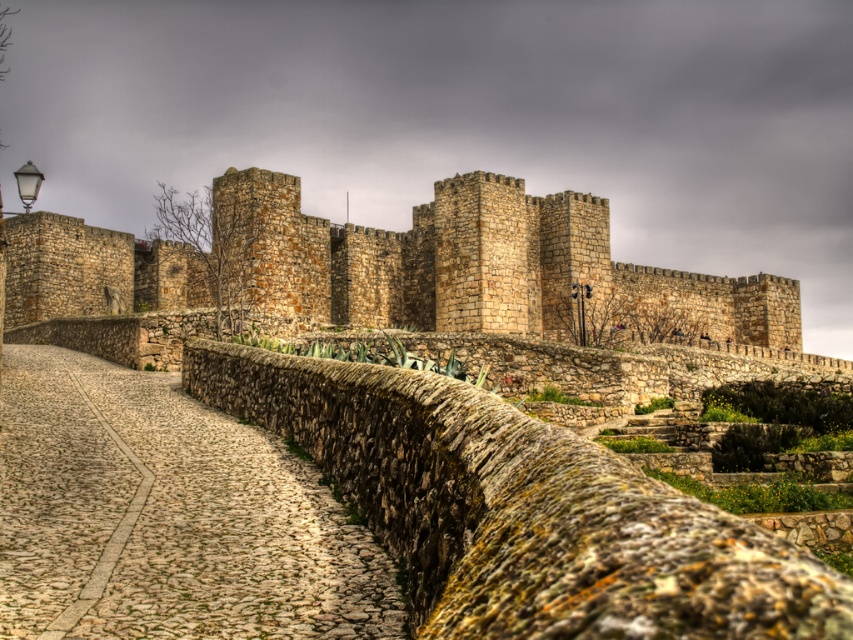
You are standing at the entrance of the historic stone fortress and see the green mossy stone wall at center and the cobblestone path at center. Which object is positioned higher in elevation?

The green mossy stone wall at center is located above the cobblestone path at center, so it is positioned higher in elevation.

You are a medieval knight approaching the fortress. You need to cross the cobblestone path at center while avoiding the green mossy stone wall at center. Is the wall too tall to step over?

The green mossy stone wall at center has a greater height compared to the cobblestone path at center. Since the wall is taller than the path, it might be difficult for the knight to step over it without assistance.